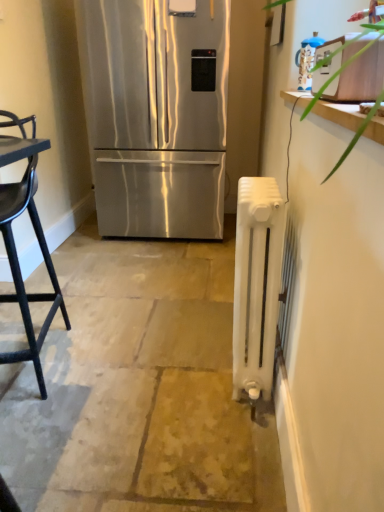
The width and height of the screenshot is (384, 512). I want to click on white painted radiator at right, so click(257, 285).

This screenshot has height=512, width=384. Describe the element at coordinates (307, 60) in the screenshot. I see `blue glossy kettle at upper right` at that location.

Measure the distance between point (277, 496) and camera.

The depth of point (277, 496) is 1.18 meters.

This screenshot has width=384, height=512. In order to click on white painted radiator at right in this screenshot , I will do `click(257, 285)`.

How many degrees apart are the facing directions of black matte chair at left and white painted radiator at right?

95 degrees separate the facing orientations of black matte chair at left and white painted radiator at right.

Which of these two, black matte chair at left or white painted radiator at right, is wider?

Wider between the two is white painted radiator at right.

Is black matte chair at left taller or shorter than white painted radiator at right?

Clearly, black matte chair at left is taller compared to white painted radiator at right.

What's the angular difference between stainless steel refrigerator at center and white painted radiator at right's facing directions?

They differ by 88.5 degrees in their facing directions.

In the scene shown: How far apart are stainless steel refrigerator at center and white painted radiator at right?

stainless steel refrigerator at center and white painted radiator at right are 1.53 meters apart.

Based on their sizes in the image, would you say stainless steel refrigerator at center is bigger or smaller than white painted radiator at right?

Clearly, stainless steel refrigerator at center is larger in size than white painted radiator at right.

Locate an element on the screen. This screenshot has width=384, height=512. radiator in front of the stainless steel refrigerator at center is located at coordinates (257, 285).

Are black matte chair at left and blue glossy kettle at upper right making contact?

black matte chair at left and blue glossy kettle at upper right are clearly separated.

Is black matte chair at left facing away from blue glossy kettle at upper right?

No, black matte chair at left is not facing away from blue glossy kettle at upper right.

Is black matte chair at left wider than blue glossy kettle at upper right?

Correct, the width of black matte chair at left exceeds that of blue glossy kettle at upper right.

Is black matte chair at left further to the viewer compared to blue glossy kettle at upper right?

No, it is in front of blue glossy kettle at upper right.

Which is correct: white painted radiator at right is inside white painted radiator at right, or outside of it?

white painted radiator at right is spatially situated outside white painted radiator at right.

Looking at this image, considering the sizes of white painted radiator at right and white painted radiator at right in the image, is white painted radiator at right bigger or smaller than white painted radiator at right?

Considering their sizes, white painted radiator at right takes up more space than white painted radiator at right.

From a real-world perspective, who is located lower, white painted radiator at right or white painted radiator at right?

white painted radiator at right.

Does white painted radiator at right appear on the left side of white painted radiator at right?

Indeed, white painted radiator at right is positioned on the left side of white painted radiator at right.

Considering the positions of objects white painted radiator at right and stainless steel refrigerator at center in the image provided, who is more to the left, white painted radiator at right or stainless steel refrigerator at center?

From the viewer's perspective, stainless steel refrigerator at center appears more on the left side.

In terms of width, does white painted radiator at right look wider or thinner when compared to stainless steel refrigerator at center?

white painted radiator at right is thinner than stainless steel refrigerator at center.

From the image's perspective, does white painted radiator at right appear higher than stainless steel refrigerator at center?

No, from the image's perspective, white painted radiator at right is not over stainless steel refrigerator at center.

Which object is further away from the camera, white painted radiator at right or stainless steel refrigerator at center?

stainless steel refrigerator at center is further away from the camera.

Which object is wider, stainless steel refrigerator at center or blue glossy kettle at upper right?

Wider between the two is stainless steel refrigerator at center.

Is stainless steel refrigerator at center further to camera compared to blue glossy kettle at upper right?

Yes, the depth of stainless steel refrigerator at center is greater than that of blue glossy kettle at upper right.

From the image's perspective, does stainless steel refrigerator at center appear higher than blue glossy kettle at upper right?

Yes, from the image's perspective, stainless steel refrigerator at center is on top of blue glossy kettle at upper right.

From the image's perspective, who appears lower, white painted radiator at right or blue glossy kettle at upper right?

white painted radiator at right is shown below in the image.

Considering the relative positions of white painted radiator at right and blue glossy kettle at upper right in the image provided, is white painted radiator at right to the left or to the right of blue glossy kettle at upper right?

In the image, white painted radiator at right appears on the left side of blue glossy kettle at upper right.

Is white painted radiator at right inside or outside of blue glossy kettle at upper right?

The correct answer is: outside.

The image size is (384, 512). Find the location of `concrete in front of the black matte chair at left`. concrete in front of the black matte chair at left is located at coordinates (139, 388).

Identify the location of radiator that is under the stainless steel refrigerator at center (from a real-world perspective). (257, 285).

Based on their spatial positions, is stainless steel refrigerator at center or white painted radiator at right closer to black matte chair at left?

white painted radiator at right.

When comparing their distances from blue glossy kettle at upper right, does stainless steel refrigerator at center or black matte chair at left seem further?

black matte chair at left is further to blue glossy kettle at upper right.

When comparing their distances from blue glossy kettle at upper right, does black matte chair at left or white painted radiator at right seem further?

The object further to blue glossy kettle at upper right is white painted radiator at right.

Estimate the real-world distances between objects in this image. Which object is further from white painted radiator at right, black matte chair at left or blue glossy kettle at upper right?

black matte chair at left.

Looking at the image, which one is located closer to white painted radiator at right, black matte chair at left or white painted radiator at right?

white painted radiator at right.

Based on their spatial positions, is blue glossy kettle at upper right or white painted radiator at right closer to white painted radiator at right?

Among the two, white painted radiator at right is located nearer to white painted radiator at right.

Based on their spatial positions, is white painted radiator at right or stainless steel refrigerator at center further from blue glossy kettle at upper right?

white painted radiator at right lies further to blue glossy kettle at upper right than the other object.

Considering their positions, is blue glossy kettle at upper right positioned closer to black matte chair at left than white painted radiator at right?

The object closer to black matte chair at left is white painted radiator at right.

Image resolution: width=384 pixels, height=512 pixels. Find the location of `radiator between black matte chair at left and blue glossy kettle at upper right in the horizontal direction`. radiator between black matte chair at left and blue glossy kettle at upper right in the horizontal direction is located at coordinates (257, 285).

The width and height of the screenshot is (384, 512). In order to click on appliance between black matte chair at left and stainless steel refrigerator at center in the front-back direction in this screenshot , I will do `click(307, 60)`.

Identify the location of concrete between black matte chair at left and white painted radiator at right from left to right. This screenshot has height=512, width=384. (139, 388).

Locate an element on the screen. appliance located between white painted radiator at right and stainless steel refrigerator at center in the depth direction is located at coordinates (307, 60).